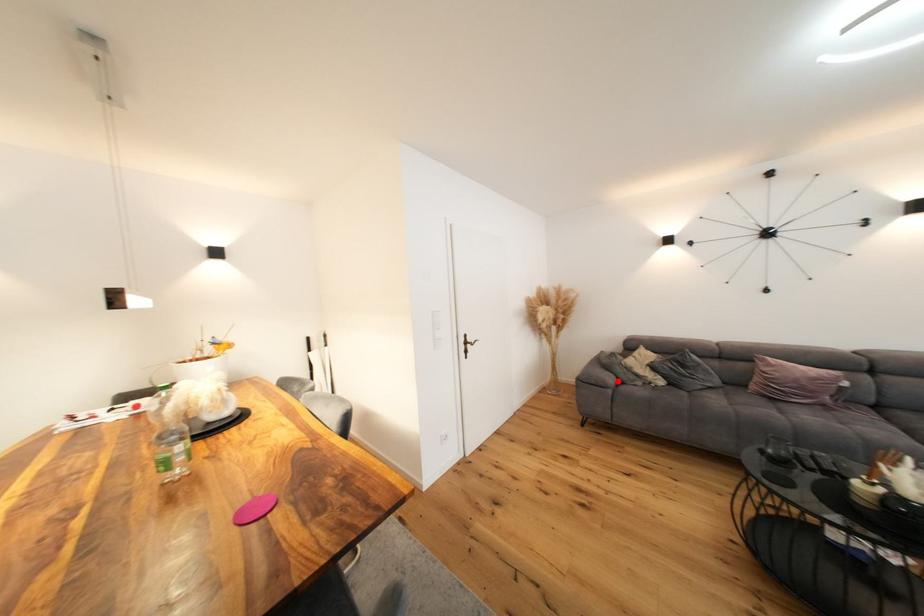
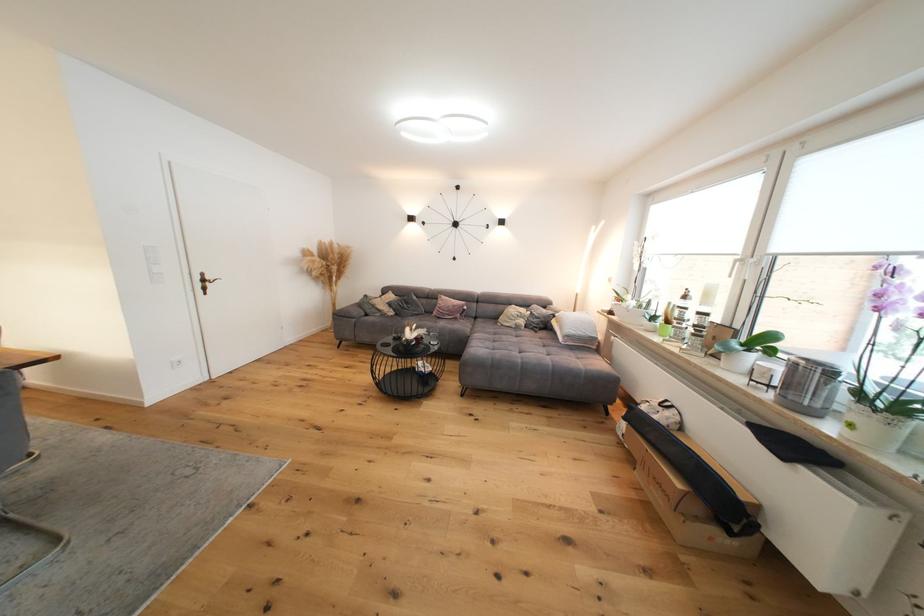
Question: I am providing you with two images of the same scene from different viewpoints. Given a red point in image1, look at the same physical point in image2. Is it:

Choices:
 (A) Closer to the viewpoint
 (B) Farther from the viewpoint

Answer: (A)